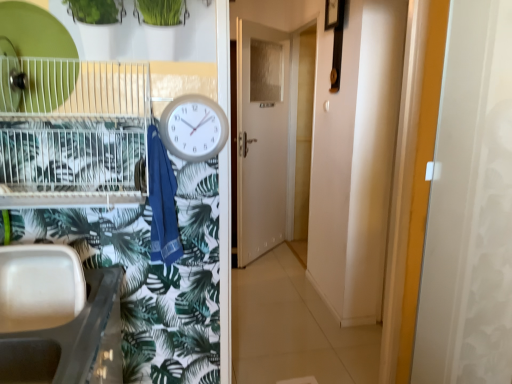
Question: Could you tell me if white glossy door at center is turned towards white glossy screen door at right?

Choices:
 (A) yes
 (B) no

Answer: (B)

Question: Is white glossy door at center not close to white glossy screen door at right?

Choices:
 (A) no
 (B) yes

Answer: (B)

Question: From a real-world perspective, is white glossy door at center below white glossy screen door at right?

Choices:
 (A) yes
 (B) no

Answer: (A)

Question: Is white glossy door at center to the right of white glossy screen door at right from the viewer's perspective?

Choices:
 (A) yes
 (B) no

Answer: (B)

Question: From the image's perspective, is white glossy door at center below white glossy screen door at right?

Choices:
 (A) no
 (B) yes

Answer: (A)

Question: Considering the relative sizes of white glossy door at center and white glossy screen door at right in the image provided, is white glossy door at center bigger than white glossy screen door at right?

Choices:
 (A) no
 (B) yes

Answer: (B)

Question: Is the depth of blue cotton towel at center less than that of white plastic clock at center?

Choices:
 (A) yes
 (B) no

Answer: (A)

Question: From a real-world perspective, is blue cotton towel at center positioned under white plastic clock at center based on gravity?

Choices:
 (A) no
 (B) yes

Answer: (B)

Question: Considering the relative sizes of blue cotton towel at center and white plastic clock at center in the image provided, is blue cotton towel at center shorter than white plastic clock at center?

Choices:
 (A) no
 (B) yes

Answer: (A)

Question: From the image's perspective, is blue cotton towel at center below white plastic clock at center?

Choices:
 (A) yes
 (B) no

Answer: (A)

Question: Is blue cotton towel at center wider than white plastic clock at center?

Choices:
 (A) yes
 (B) no

Answer: (A)

Question: Considering the relative sizes of blue cotton towel at center and white plastic clock at center in the image provided, is blue cotton towel at center bigger than white plastic clock at center?

Choices:
 (A) no
 (B) yes

Answer: (B)

Question: Is white plastic sink at lower left positioned far away from white glossy door at center?

Choices:
 (A) yes
 (B) no

Answer: (A)